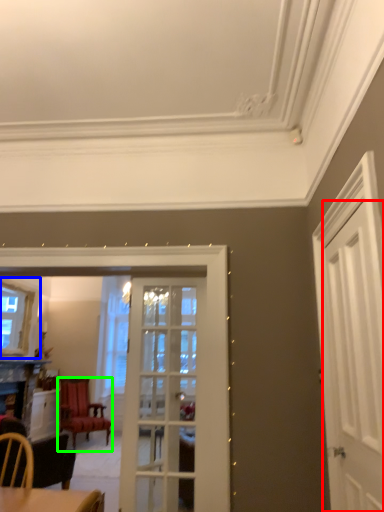
Question: Which is nearer to the door (highlighted by a red box)? window (highlighted by a blue box) or chair (highlighted by a green box).

Choices:
 (A) window
 (B) chair

Answer: (A)